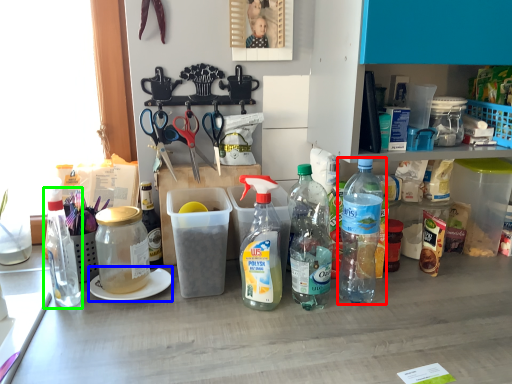
Question: Which is nearer to the bottle (highlighted by a red box)? plate (highlighted by a blue box) or bottle (highlighted by a green box).

Choices:
 (A) plate
 (B) bottle

Answer: (A)